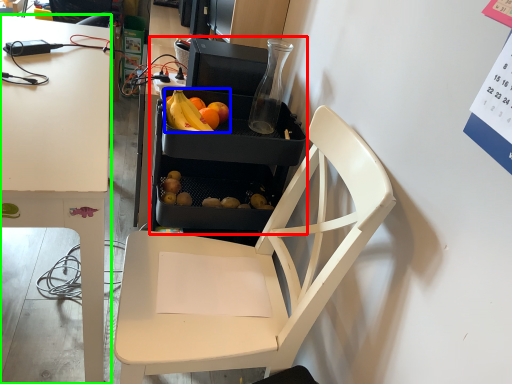
Question: Estimate the real-world distances between objects in this image. Which object is farther from appliance (highlighted by a red box), grapefruit (highlighted by a blue box) or desk (highlighted by a green box)?

Choices:
 (A) grapefruit
 (B) desk

Answer: (B)